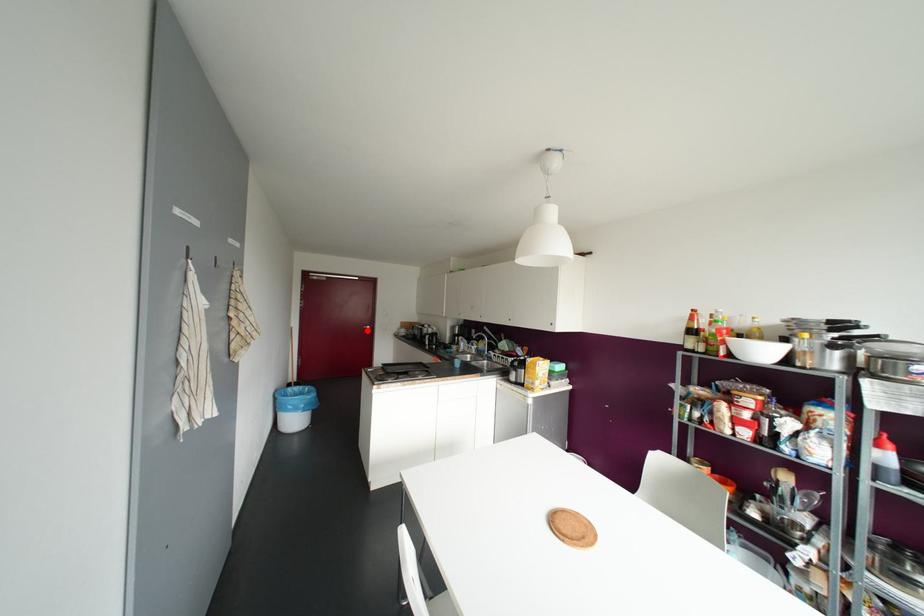
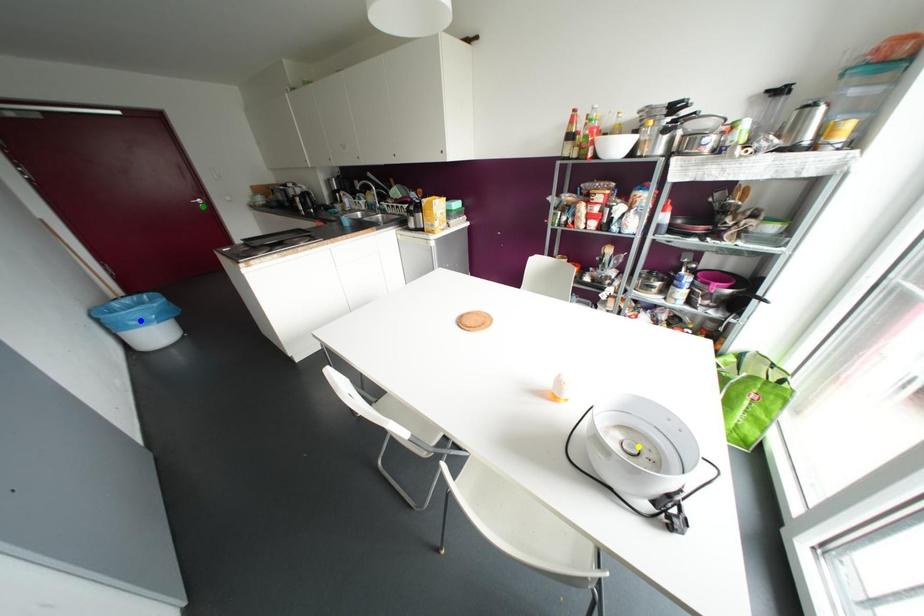
Question: I am providing you with two images of the same scene from different viewpoints. A red point is marked on the first image. You are given multiple points on the second image. In image 2, which mark is for the same physical point as the one in image 1?

Choices:
 (A) green point
 (B) yellow point
 (C) blue point

Answer: (A)